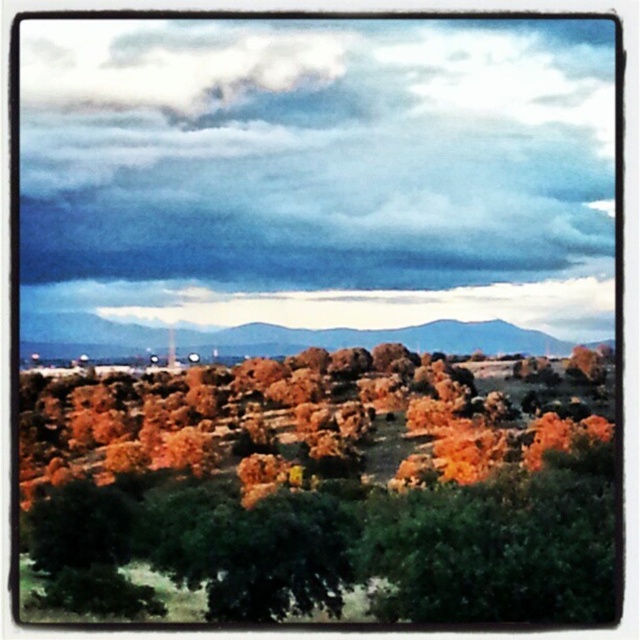
You are an architect designing a new observatory that requires a clear view of the sky. You have to choose between placing it near the dark cloudy sky at upper center or the brown rocky mountain at center. Based on their positions, which location would allow better visibility of the sky?

The dark cloudy sky at upper center is above the brown rocky mountain at center, so placing the observatory near the brown rocky mountain at center would provide a better vantage point to view the sky since it is positioned below the sky.

You are standing in the landscape scene described. There are two points marked in the image. The first point is at coordinates point (138,164) and the second is at point (476,333). Which point is closer to you?

Point (138,164) is closer to the viewer than point (476,333).